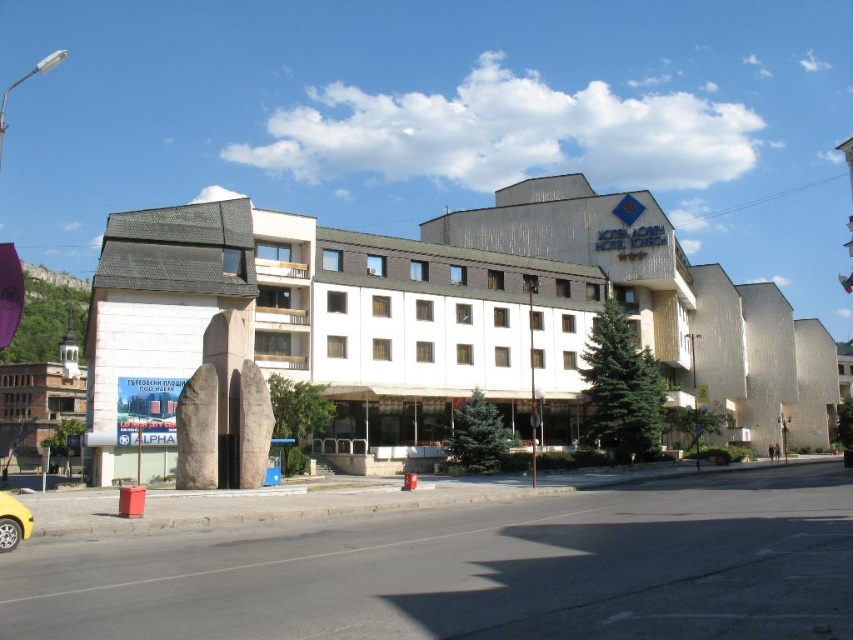
Question: Which point is farther to the camera?

Choices:
 (A) white concrete building at center
 (B) yellow matte taxi at lower left

Answer: (A)

Question: Which point appears closest to the camera in this image?

Choices:
 (A) (0, 548)
 (B) (556, 276)

Answer: (A)

Question: Is white concrete building at center wider than yellow matte taxi at lower left?

Choices:
 (A) yes
 (B) no

Answer: (A)

Question: Can you confirm if white concrete building at center is thinner than yellow matte taxi at lower left?

Choices:
 (A) yes
 (B) no

Answer: (B)

Question: Where is white concrete building at center located in relation to yellow matte taxi at lower left in the image?

Choices:
 (A) above
 (B) below

Answer: (A)

Question: Which point is farther to the camera?

Choices:
 (A) (26, 512)
 (B) (135, 237)

Answer: (B)